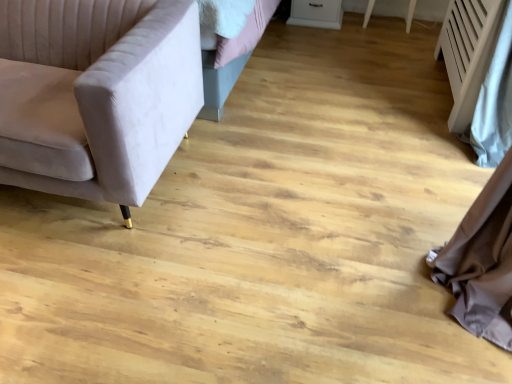
Locate an element on the screen. This screenshot has height=384, width=512. free space to the left of white textured radiator at right is located at coordinates (398, 144).